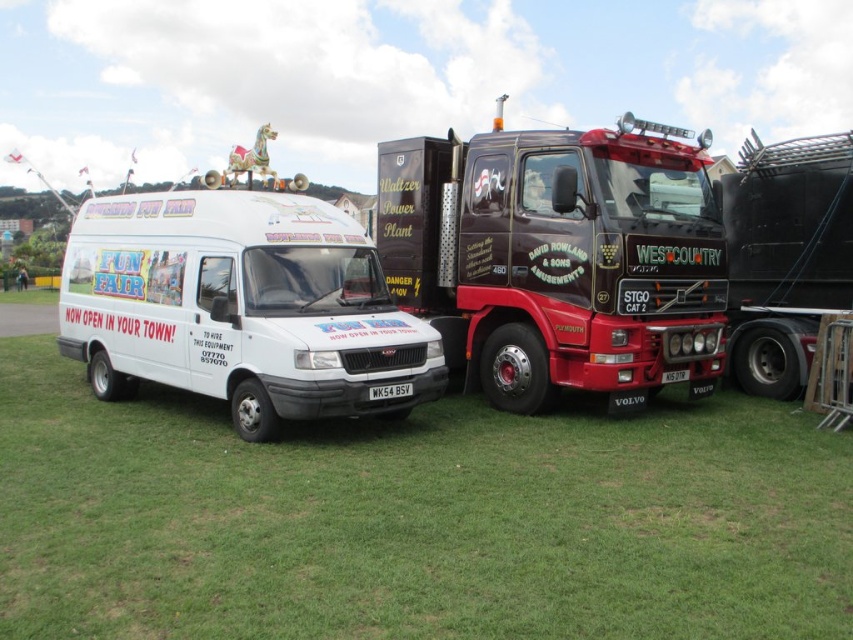
Question: Which object is positioned farthest from the black textured trailer truck at right?

Choices:
 (A) green grass at lower center
 (B) white glossy van at left

Answer: (B)

Question: Considering the real-world distances, which object is closest to the black textured trailer truck at right?

Choices:
 (A) green grass at lower center
 (B) white glossy van at left
 (C) shiny metallic truck at center

Answer: (A)

Question: Is green grass at lower center bigger than black textured trailer truck at right?

Choices:
 (A) no
 (B) yes

Answer: (A)

Question: Which object is closer to the camera taking this photo?

Choices:
 (A) green grass at lower center
 (B) shiny metallic truck at center

Answer: (A)

Question: Does green grass at lower center appear on the right side of white glossy van at left?

Choices:
 (A) yes
 (B) no

Answer: (A)

Question: Is green grass at lower center smaller than black textured trailer truck at right?

Choices:
 (A) yes
 (B) no

Answer: (A)